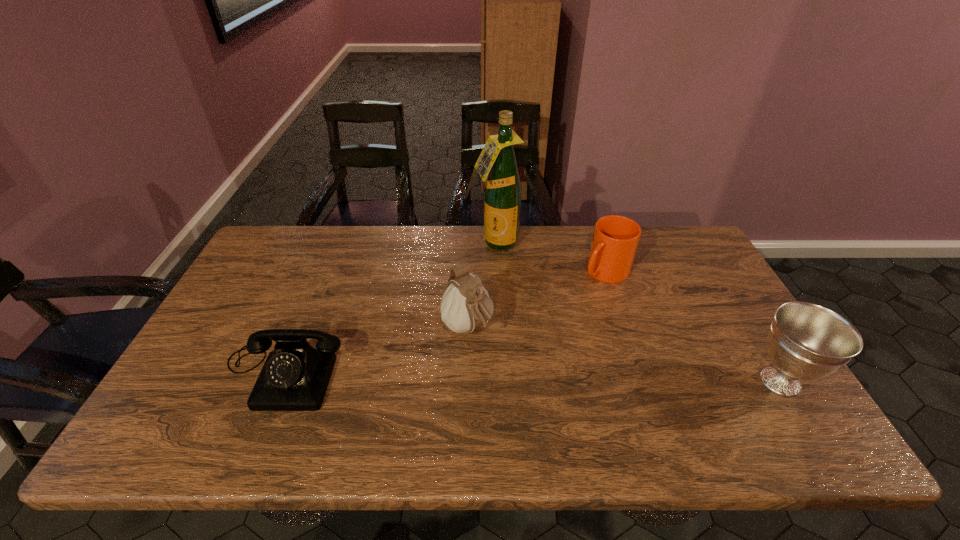
Where is `vacant space located on the handle side of the fourth object from left to right`? The height and width of the screenshot is (540, 960). vacant space located on the handle side of the fourth object from left to right is located at coordinates (541, 332).

Where is `vacant space situated 0.160m on the handle side of the fourth object from left to right`? vacant space situated 0.160m on the handle side of the fourth object from left to right is located at coordinates (563, 313).

Locate an element on the screen. This screenshot has height=540, width=960. vacant space located on the front-facing side of the pouch is located at coordinates (523, 382).

In order to click on vacant space situated 0.180m on the front-facing side of the pouch in this screenshot , I will do `click(532, 390)`.

Identify the location of vacant space located 0.070m on the front-facing side of the pouch. (501, 362).

Identify the location of blank area located 0.370m on the front-facing side of the farthest object. This screenshot has height=540, width=960. (502, 341).

This screenshot has width=960, height=540. I want to click on vacant space positioned on the front-facing side of the farthest object, so click(x=500, y=304).

Identify the location of free space located 0.340m on the front-facing side of the farthest object. (502, 332).

Find the location of a particular element. mug situated at the far edge is located at coordinates (615, 239).

The image size is (960, 540). In order to click on liquor situated at the far edge in this screenshot , I will do (502, 196).